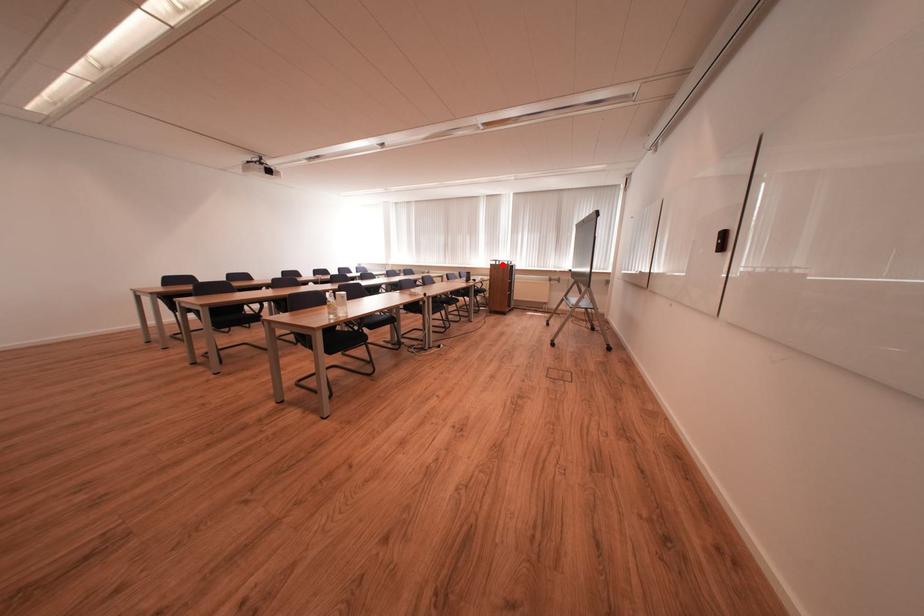
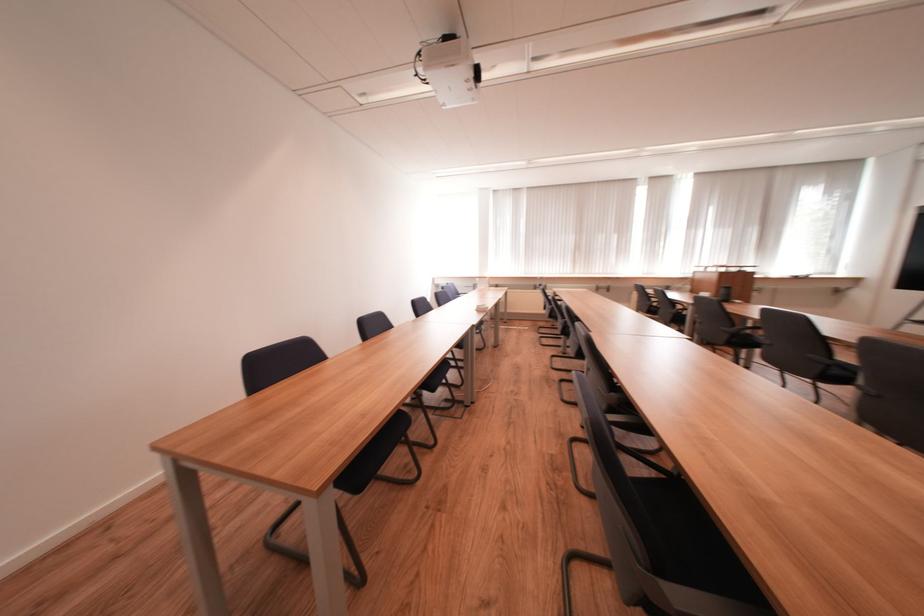
Question: I am providing you with two images of the same scene from different viewpoints. A red point is marked on the first image. Is the red point's position out of view in image 2?

Choices:
 (A) Yes
 (B) No

Answer: (A)